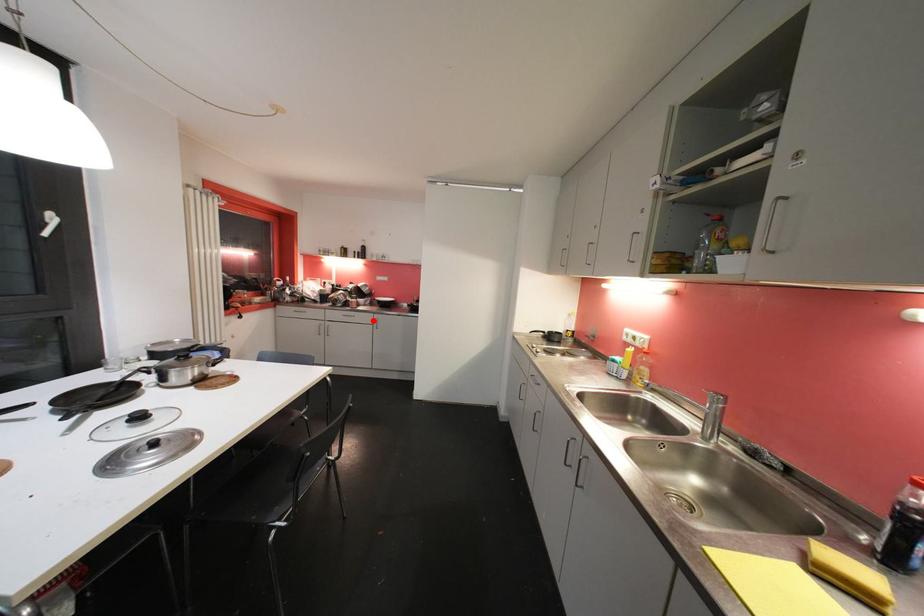
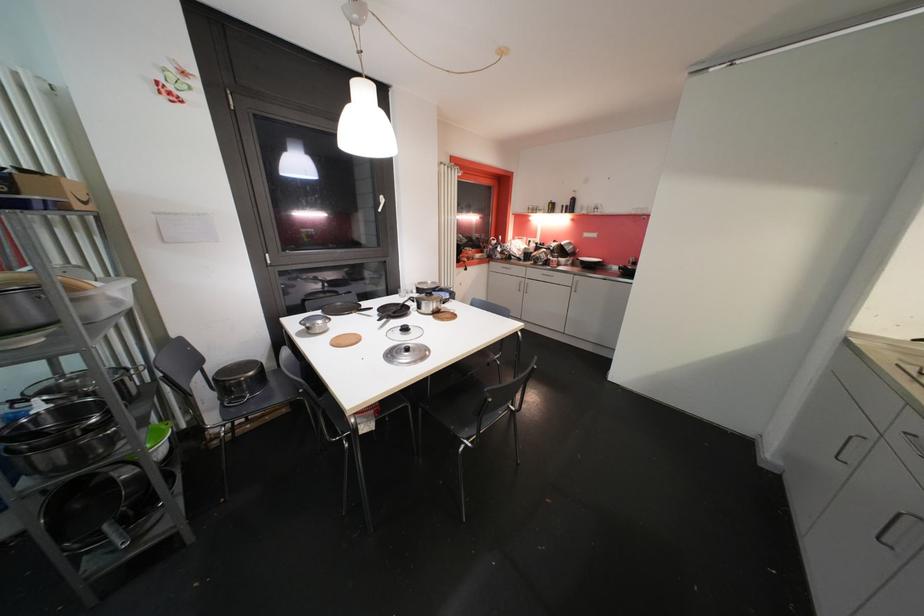
Question: I am providing you with two images of the same scene from different viewpoints. In image1, a red point is highlighted. Considering the same 3D point in image2, which of the following is correct?

Choices:
 (A) It is closer
 (B) It is farther

Answer: (B)